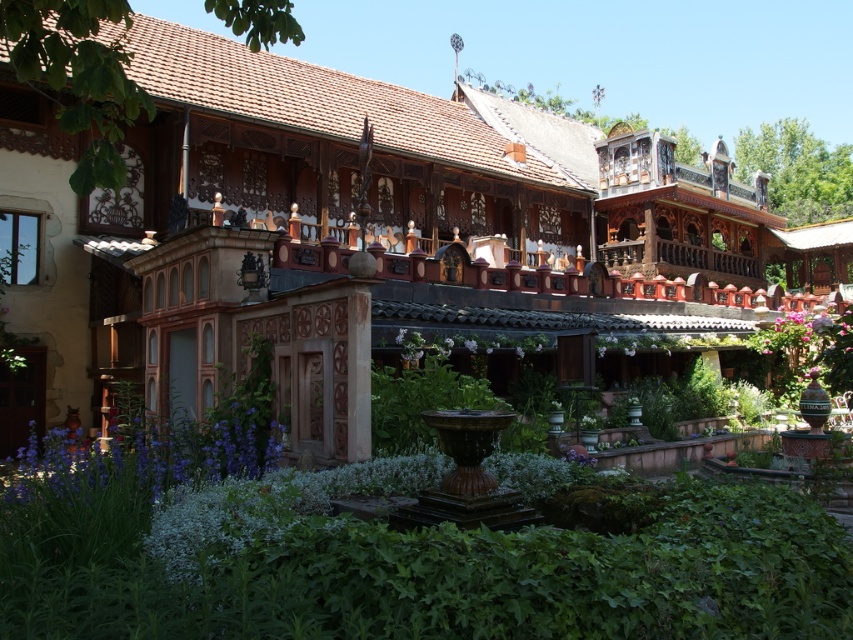
Question: Which point is closer to the camera taking this photo?

Choices:
 (A) coord(550,166)
 (B) coord(521,348)

Answer: (B)

Question: Can you confirm if wooden balcony at center is smaller than purple matte flower at center?

Choices:
 (A) yes
 (B) no

Answer: (B)

Question: Is wooden balcony at center bigger than purple matte flower at center?

Choices:
 (A) no
 (B) yes

Answer: (B)

Question: Among these objects, which one is nearest to the camera?

Choices:
 (A) wooden balcony at center
 (B) purple matte flower at center

Answer: (A)

Question: Is wooden balcony at center in front of purple matte flower at center?

Choices:
 (A) no
 (B) yes

Answer: (B)